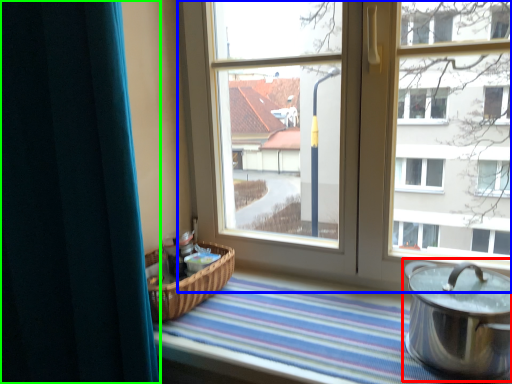
Question: Considering the real-world distances, which object is farthest from crock pot (highlighted by a red box)? window (highlighted by a blue box) or curtain (highlighted by a green box)?

Choices:
 (A) window
 (B) curtain

Answer: (B)